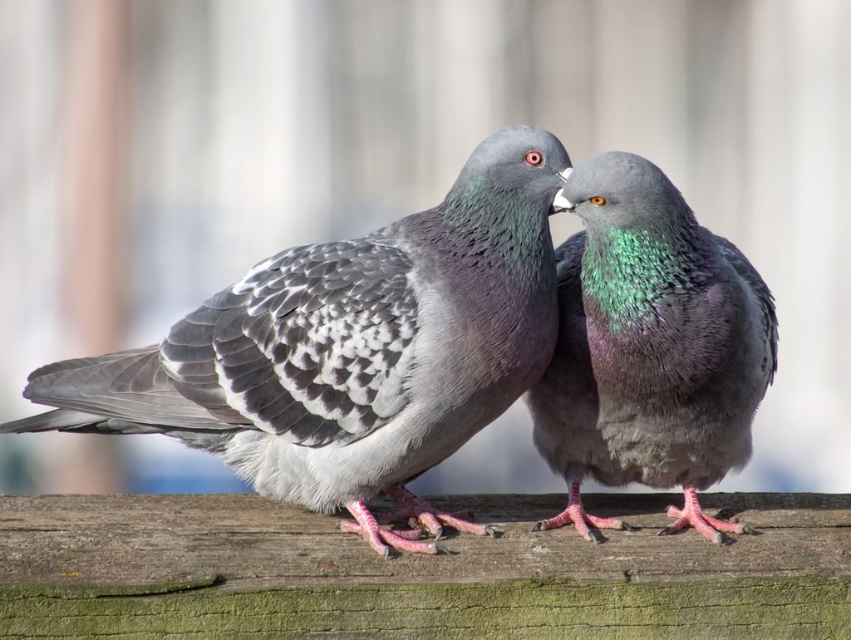
Is gray speckled feathers at center positioned at the back of shiny green feathers at center?

No, it is in front of shiny green feathers at center.

Does point (443, 333) come closer to viewer compared to point (650, 394)?

That is True.

Does point (372, 460) come closer to viewer compared to point (757, 284)?

Yes, it is.

I want to click on gray speckled feathers at center, so click(x=351, y=349).